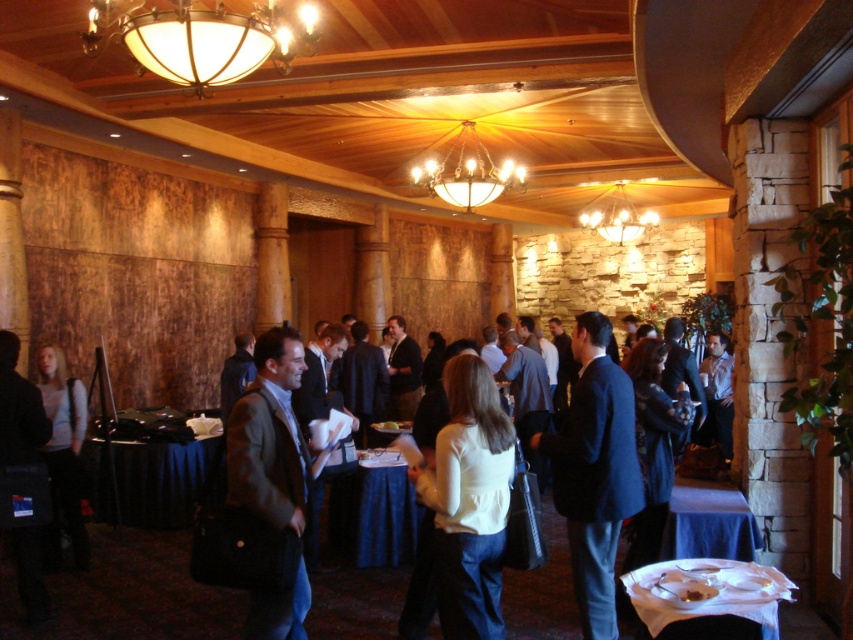
Which of these two, dark blue suit at center or gold metallic chandelier at center, stands taller?

Standing taller between the two is dark blue suit at center.

Based on the photo, is dark blue suit at center taller than gold metallic chandelier at center?

Yes, dark blue suit at center is taller than gold metallic chandelier at center.

What do you see at coordinates (595, 472) in the screenshot?
I see `dark blue suit at center` at bounding box center [595, 472].

Find the location of `dark blue suit at center`. dark blue suit at center is located at coordinates (595, 472).

Which is in front, point (445, 600) or point (463, 125)?

Point (445, 600) is more forward.

Image resolution: width=853 pixels, height=640 pixels. Describe the element at coordinates (462, 509) in the screenshot. I see `white matte shirt at center` at that location.

Where is `white matte shirt at center`? This screenshot has width=853, height=640. white matte shirt at center is located at coordinates (462, 509).

Is white matte shirt at center wider than matte gray sweater at center?

Yes, white matte shirt at center is wider than matte gray sweater at center.

Between white matte shirt at center and matte gray sweater at center, which one is positioned lower?

Positioned lower is matte gray sweater at center.

Image resolution: width=853 pixels, height=640 pixels. I want to click on white matte shirt at center, so click(462, 509).